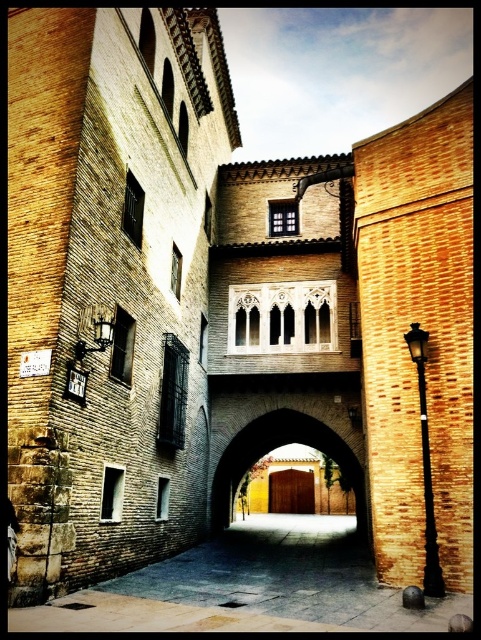
You are standing in the middle of the smooth stone alley at center. Looking up, you notice the streetlamp mounted on the left building. Can you determine whether the streetlamp is positioned to the left or right side of the alley?

The smooth stone alley at center is located at point (249, 588), which indicates its central position. The streetlamp is on the left building, so it would be on the left side of the alley. Therefore, the streetlamp is positioned to the left side of the alley.

From the picture: You are standing in the narrow alleyway and want to enter the brown wooden door at center. Which direction should you walk to reach it from the smooth stone alley at center?

The smooth stone alley at center is positioned on the left side of the brown wooden door at center, so you should walk to the right to reach the brown wooden door at center.

You are a delivery person trying to navigate through the narrow alleyway. You notice the smooth stone alley at center and the brown wooden door at center. Which object is shorter in height?

The smooth stone alley at center is not as tall as brown wooden door at center, so the smooth stone alley at center is shorter in height.